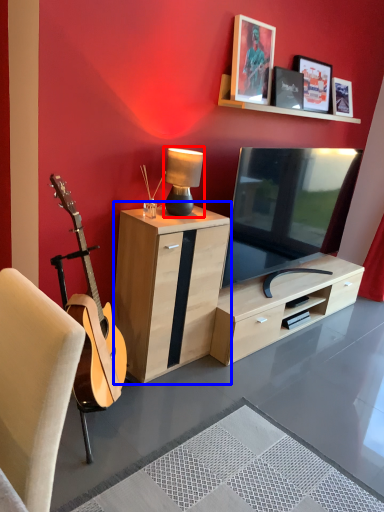
Question: Which of the following is the farthest to the observer, table lamp (highlighted by a red box) or cabinetry (highlighted by a blue box)?

Choices:
 (A) table lamp
 (B) cabinetry

Answer: (A)